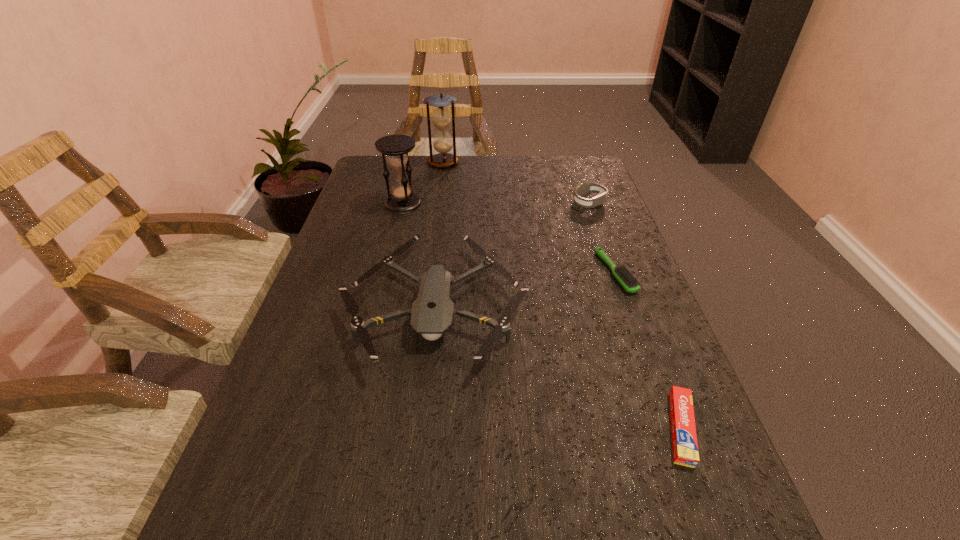
This screenshot has height=540, width=960. In order to click on hairbrush that is at the right edge in this screenshot , I will do `click(622, 274)`.

You are a GUI agent. You are given a task and a screenshot of the screen. Output one action in this format:
    pyautogui.click(x=<x>, y=<y>)
    Task: Click on the toothpaste at the right edge
    The width and height of the screenshot is (960, 540).
    Given the screenshot: What is the action you would take?
    pyautogui.click(x=684, y=439)

Where is `vacant space at the far edge of the desktop`? Image resolution: width=960 pixels, height=540 pixels. vacant space at the far edge of the desktop is located at coordinates (501, 188).

This screenshot has width=960, height=540. Find the location of `free space at the left edge`. free space at the left edge is located at coordinates (377, 218).

At what (x,y) coordinates should I click in order to perform the action: click on vacant point at the right edge. Please return your answer as a coordinate pair (x, y). Looking at the image, I should click on (580, 271).

At what (x,y) coordinates should I click in order to perform the action: click on vacant space at the far right corner of the desktop. Please return your answer as a coordinate pair (x, y). The height and width of the screenshot is (540, 960). Looking at the image, I should click on (586, 164).

You are a GUI agent. You are given a task and a screenshot of the screen. Output one action in this format:
    pyautogui.click(x=<x>, y=<y>)
    Task: Click on the free space between the drone and the farthest object
    
    Given the screenshot: What is the action you would take?
    pyautogui.click(x=440, y=233)

Find the location of `free spot between the watch and the shortest object`. free spot between the watch and the shortest object is located at coordinates (635, 316).

Where is `vacant area between the shortest object and the farther hourglass`? vacant area between the shortest object and the farther hourglass is located at coordinates (563, 295).

This screenshot has height=540, width=960. I want to click on free space between the hairbrush and the shorter hourglass, so click(x=509, y=238).